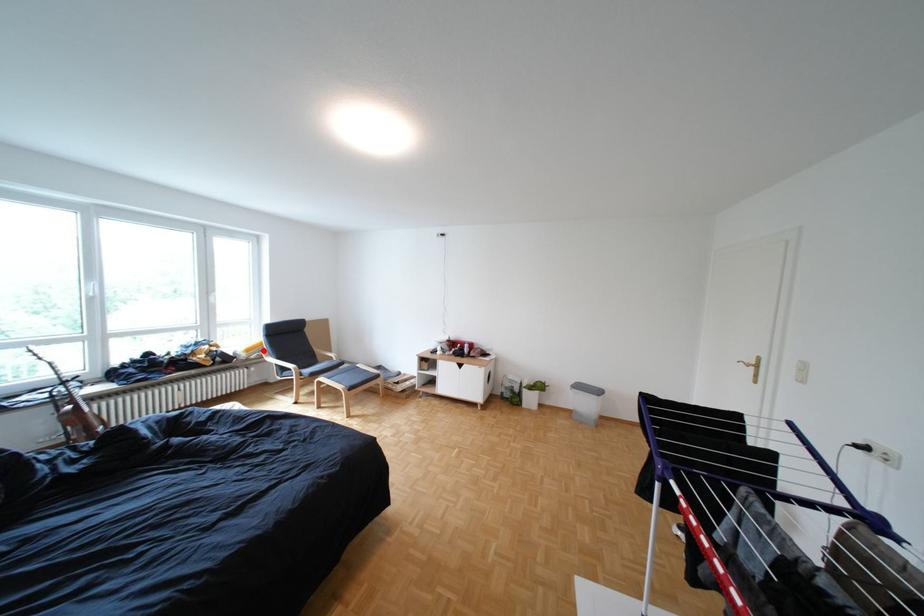
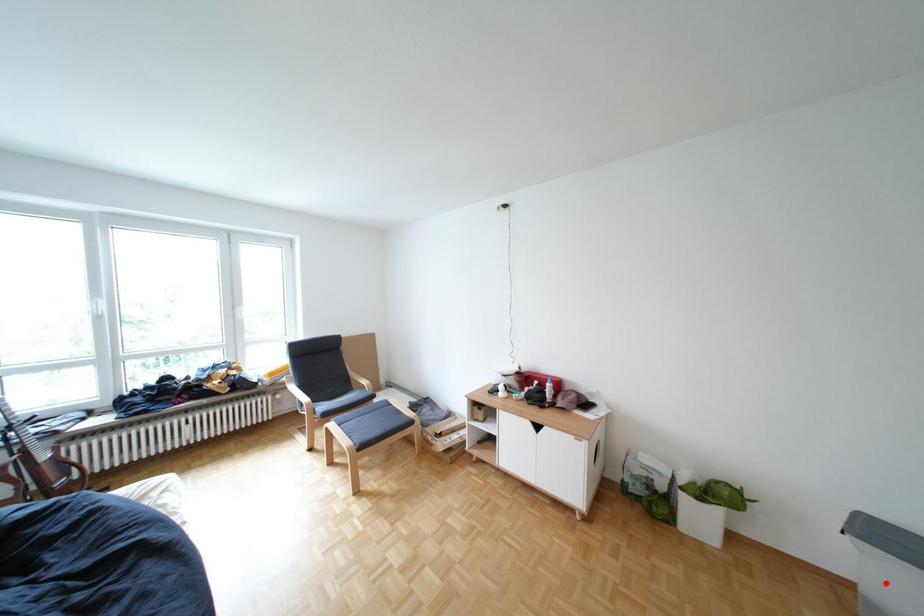
I am providing you with two images of the same scene from different viewpoints. A red point is marked on the first image and another point is marked on the second image. Do the highlighted points in image1 and image2 indicate the same real-world spot?

No